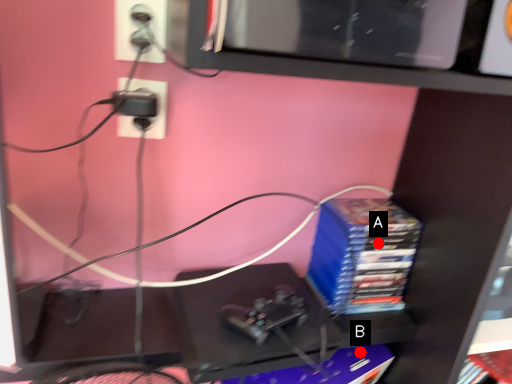
Question: Two points are circled on the image, labeled by A and B beside each circle. Which point is closer to the camera taking this photo?

Choices:
 (A) A is closer
 (B) B is closer

Answer: (A)